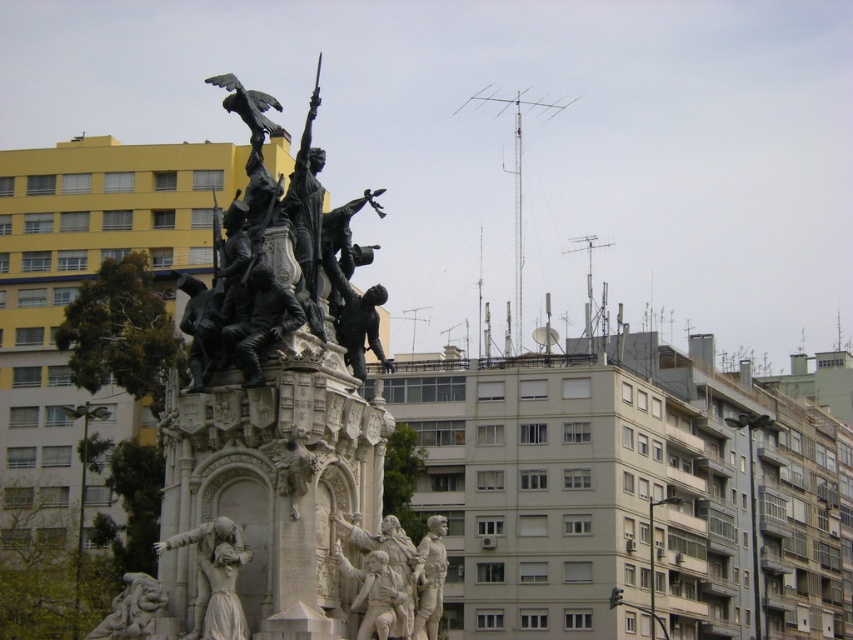
Question: Among these objects, which one is nearest to the camera?

Choices:
 (A) polished stone dragon at lower left
 (B) polished bronze figures at center
 (C) white marble statue at lower left

Answer: (A)

Question: Which is farther from the polished bronze soldier at center?

Choices:
 (A) polished stone dragon at lower left
 (B) white marble statue at lower left

Answer: (A)

Question: Can you confirm if white marble statue at lower left is positioned to the left of polished stone dragon at lower left?

Choices:
 (A) no
 (B) yes

Answer: (A)

Question: From the image, what is the correct spatial relationship of polished bronze figures at center in relation to white marble statue at lower left?

Choices:
 (A) left
 (B) right

Answer: (B)

Question: Which object appears closest to the camera in this image?

Choices:
 (A) white marble statue at lower left
 (B) polished stone dragon at lower left

Answer: (B)

Question: Can you confirm if polished bronze figures at center is smaller than polished stone dragon at lower left?

Choices:
 (A) yes
 (B) no

Answer: (A)